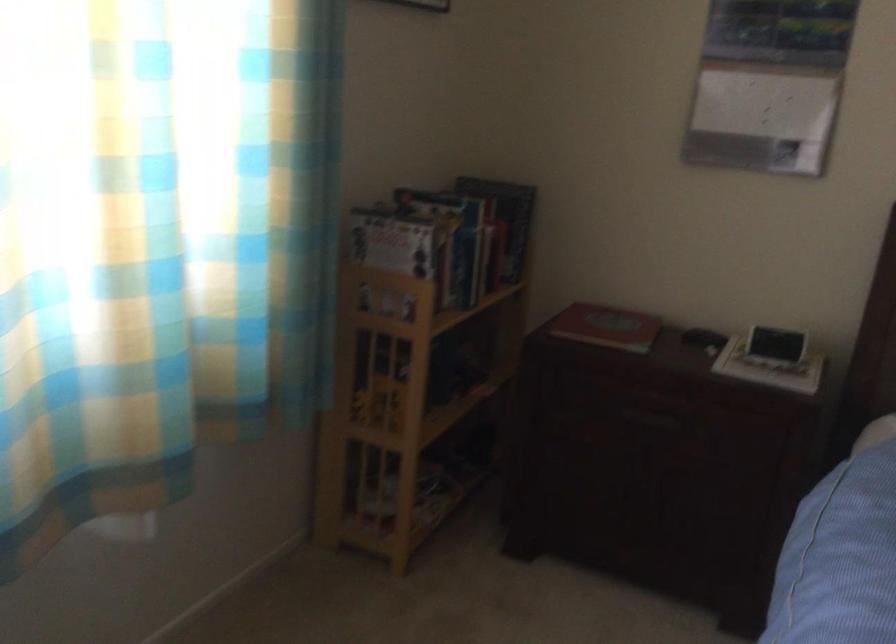
Describe the element at coordinates (652, 415) in the screenshot. The image size is (896, 644). I see `the dark drawer handle` at that location.